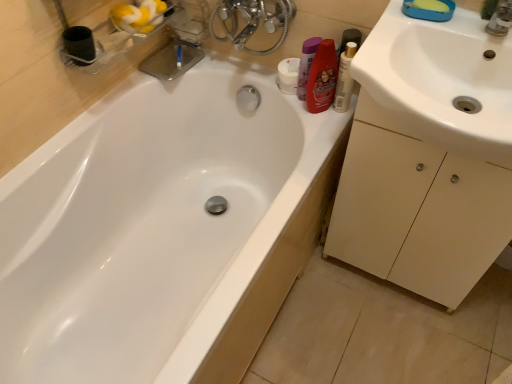
Where is `space that is in front of white plastic mouthwash at upper right`? The height and width of the screenshot is (384, 512). space that is in front of white plastic mouthwash at upper right is located at coordinates (326, 136).